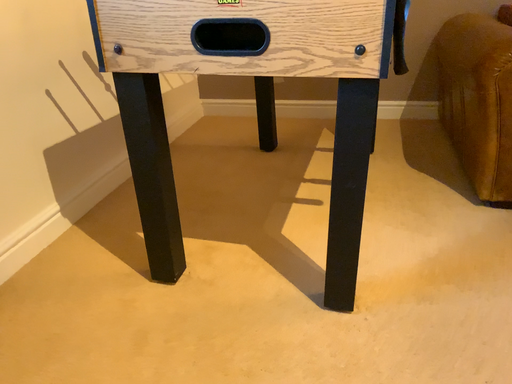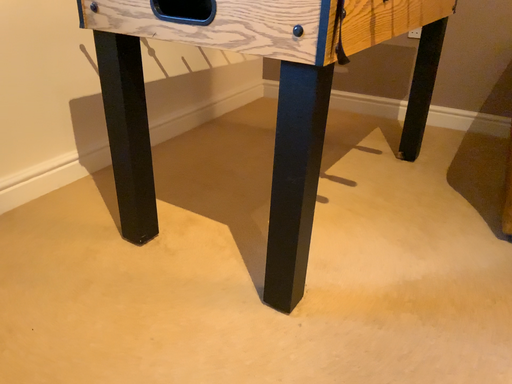
Question: How did the camera likely rotate when shooting the video?

Choices:
 (A) rotated right
 (B) rotated left

Answer: (B)